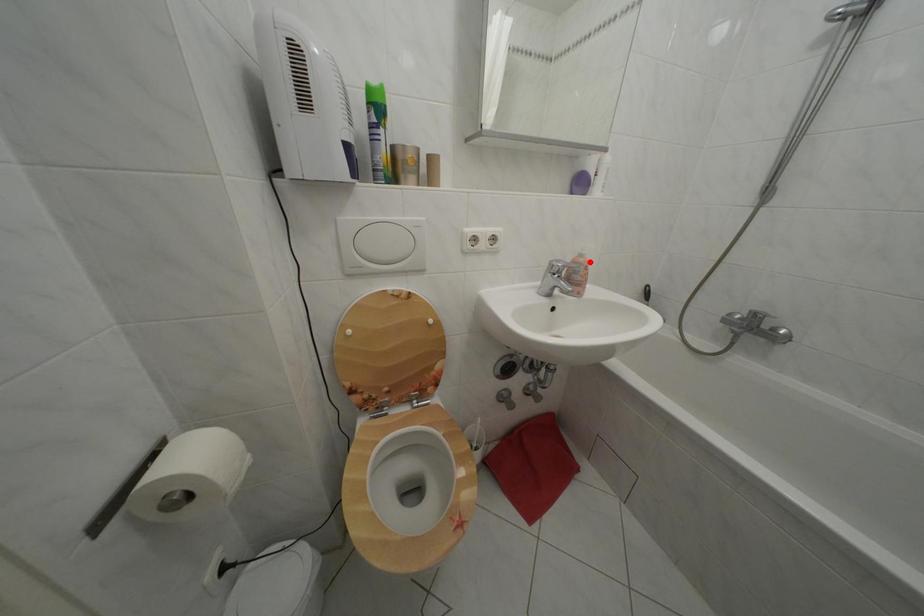
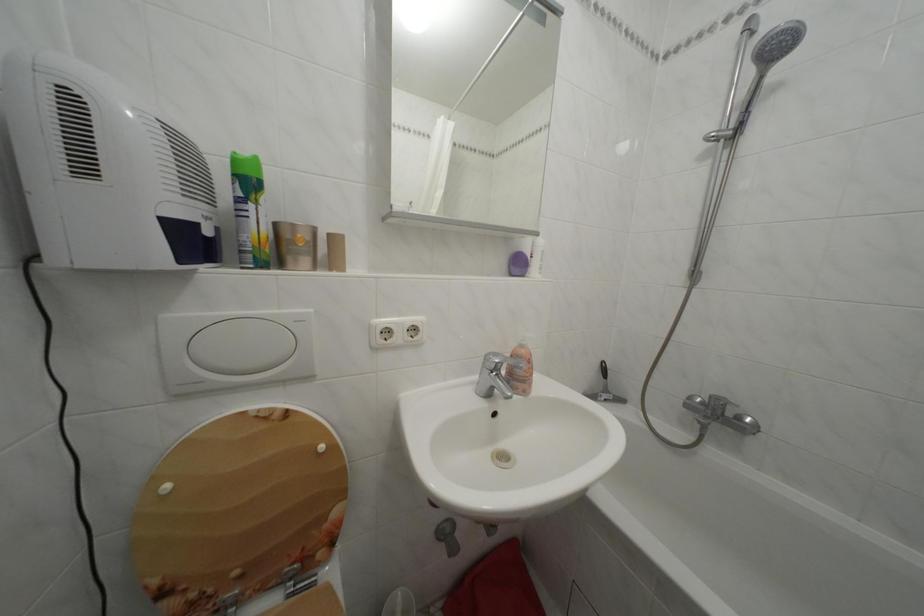
In the second image, find the point that corresponds to the highlighted location in the first image.

(530, 352)